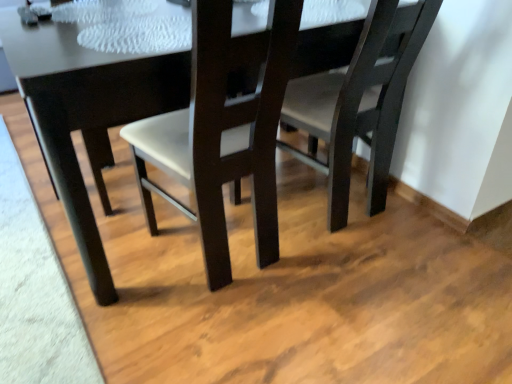
Question: Is matte dark wood chair at center, which ranks as the 1th chair in right-to-left order, to the right of matte black table at center from the viewer's perspective?

Choices:
 (A) no
 (B) yes

Answer: (B)

Question: Does matte dark wood chair at center, which is counted as the second chair, starting from the left, have a lesser height compared to matte black table at center?

Choices:
 (A) no
 (B) yes

Answer: (A)

Question: Is matte dark wood chair at center, which ranks as the 1th chair in right-to-left order, not near matte black table at center?

Choices:
 (A) no
 (B) yes

Answer: (A)

Question: From a real-world perspective, is matte dark wood chair at center, which is counted as the second chair, starting from the left, positioned under matte black table at center based on gravity?

Choices:
 (A) yes
 (B) no

Answer: (B)

Question: Can you see matte dark wood chair at center, which ranks as the 1th chair in right-to-left order, touching matte black table at center?

Choices:
 (A) no
 (B) yes

Answer: (A)

Question: Is matte black table at center taller or shorter than matte dark wood chair at center, which ranks as the 1th chair in right-to-left order?

Choices:
 (A) tall
 (B) short

Answer: (B)

Question: Based on their positions, is matte black table at center located to the left or right of matte dark wood chair at center, which is counted as the second chair, starting from the left?

Choices:
 (A) left
 (B) right

Answer: (A)

Question: Is matte black table at center inside the boundaries of matte dark wood chair at center, which ranks as the 1th chair in right-to-left order, or outside?

Choices:
 (A) outside
 (B) inside

Answer: (A)

Question: Based on their sizes in the image, would you say matte black table at center is bigger or smaller than matte dark wood chair at center, which ranks as the 1th chair in right-to-left order?

Choices:
 (A) small
 (B) big

Answer: (B)

Question: Does point (203, 228) appear closer or farther from the camera than point (151, 69)?

Choices:
 (A) closer
 (B) farther

Answer: (B)

Question: From a real-world perspective, is matte dark wood chair at center, the second chair when ordered from right to left, above or below matte black table at center?

Choices:
 (A) above
 (B) below

Answer: (A)

Question: From the image's perspective, relative to matte black table at center, is matte dark wood chair at center, the second chair when ordered from right to left, above or below?

Choices:
 (A) below
 (B) above

Answer: (A)

Question: Looking at the image, does matte dark wood chair at center, which ranks as the first chair in left-to-right order, seem bigger or smaller compared to matte black table at center?

Choices:
 (A) small
 (B) big

Answer: (A)

Question: Which is correct: matte dark wood chair at center, which ranks as the 1th chair in right-to-left order, is inside matte black table at center, or outside of it?

Choices:
 (A) outside
 (B) inside

Answer: (B)

Question: Looking at their shapes, would you say matte dark wood chair at center, which is counted as the second chair, starting from the left, is wider or thinner than matte black table at center?

Choices:
 (A) wide
 (B) thin

Answer: (B)